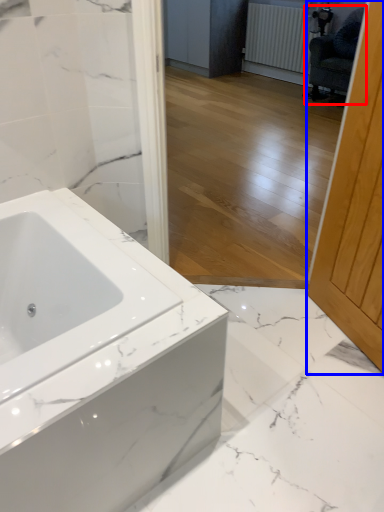
Question: Which object appears closest to the camera in this image, swivel chair (highlighted by a red box) or screen door (highlighted by a blue box)?

Choices:
 (A) swivel chair
 (B) screen door

Answer: (B)